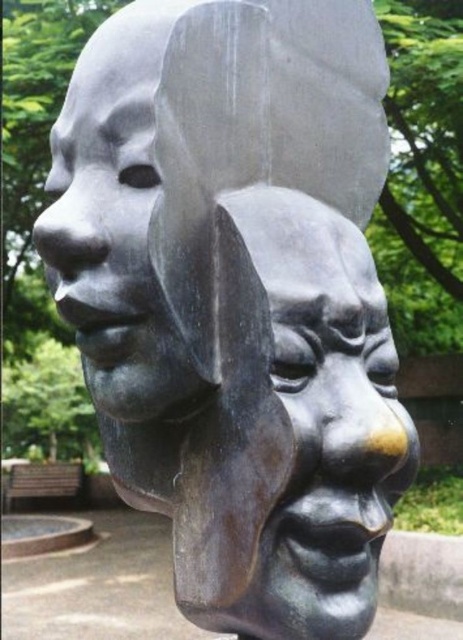
Question: Where is shiny bronze mask at center located in relation to matte bronze face at upper left in the image?

Choices:
 (A) right
 (B) left

Answer: (A)

Question: Does shiny bronze mask at center appear over matte bronze face at upper left?

Choices:
 (A) no
 (B) yes

Answer: (A)

Question: Which object is farther from the camera taking this photo?

Choices:
 (A) shiny bronze mask at center
 (B) matte bronze face at upper left

Answer: (B)

Question: Which of the following is the farthest from the observer?

Choices:
 (A) (151, 77)
 (B) (304, 444)

Answer: (A)

Question: Is shiny bronze mask at center smaller than matte bronze face at upper left?

Choices:
 (A) yes
 (B) no

Answer: (B)

Question: Which object appears closest to the camera in this image?

Choices:
 (A) matte bronze face at upper left
 (B) shiny bronze mask at center

Answer: (B)